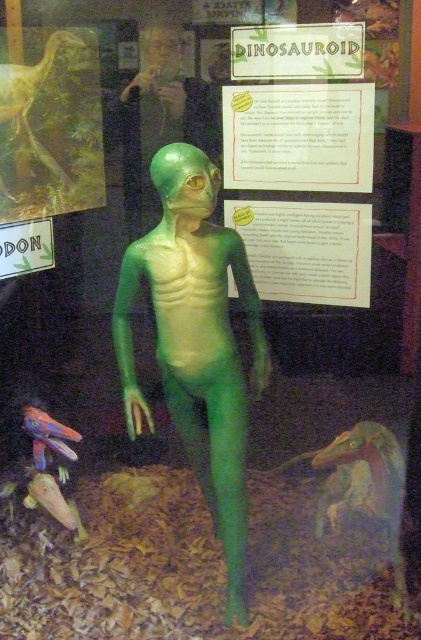
You are standing in front of the museum display featuring the DINOSAUROID model. You notice a point marked at coordinates (298, 61) on the display. If you want to touch this point with a 2.00 meter long pole, will you be able to reach it?

The point at (298, 61) is 2.40 meters away from the camera. Since the pole is only 2.00 meters long, you cannot reach the point with the pole.

Consider the image. You are a visitor at the museum and want to take a photo of both the matte plastic sign at upper center and the green matte dinosaur at upper left. Which object should you focus on first to ensure both are in the frame?

You should focus on the matte plastic sign at upper center first because it might be wider than the green matte dinosaur at upper left, so centering it first ensures both fit in the frame.